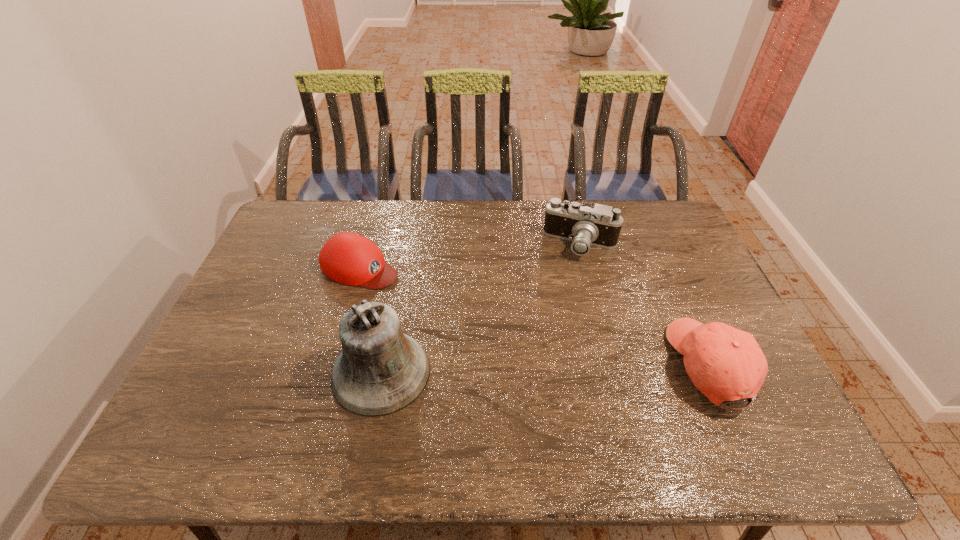
Image resolution: width=960 pixels, height=540 pixels. Identify the location of vacant space at the near edge of the desktop. (469, 404).

In the image, there is a desktop. Identify the location of vacant space at the left edge. The image size is (960, 540). pyautogui.click(x=244, y=375).

The height and width of the screenshot is (540, 960). I want to click on blank area at the right edge, so click(673, 246).

In order to click on vacant space at the far left corner in this screenshot , I will do `click(273, 234)`.

Where is `unoccupied area between the taller baseball cap and the farther baseball cap`? unoccupied area between the taller baseball cap and the farther baseball cap is located at coordinates (536, 316).

Locate an element on the screen. This screenshot has height=540, width=960. vacant space in between the right baseball cap and the shortest object is located at coordinates (536, 316).

The width and height of the screenshot is (960, 540). I want to click on free space between the bell and the third object from left to right, so click(481, 308).

Where is `vacant space in between the taller baseball cap and the second object from right to left`? The height and width of the screenshot is (540, 960). vacant space in between the taller baseball cap and the second object from right to left is located at coordinates (646, 305).

The width and height of the screenshot is (960, 540). Find the location of `unoccupied area between the farther baseball cap and the second object from right to left`. unoccupied area between the farther baseball cap and the second object from right to left is located at coordinates [x=470, y=256].

Where is `free space between the bell and the nearer baseball cap`? Image resolution: width=960 pixels, height=540 pixels. free space between the bell and the nearer baseball cap is located at coordinates (546, 369).